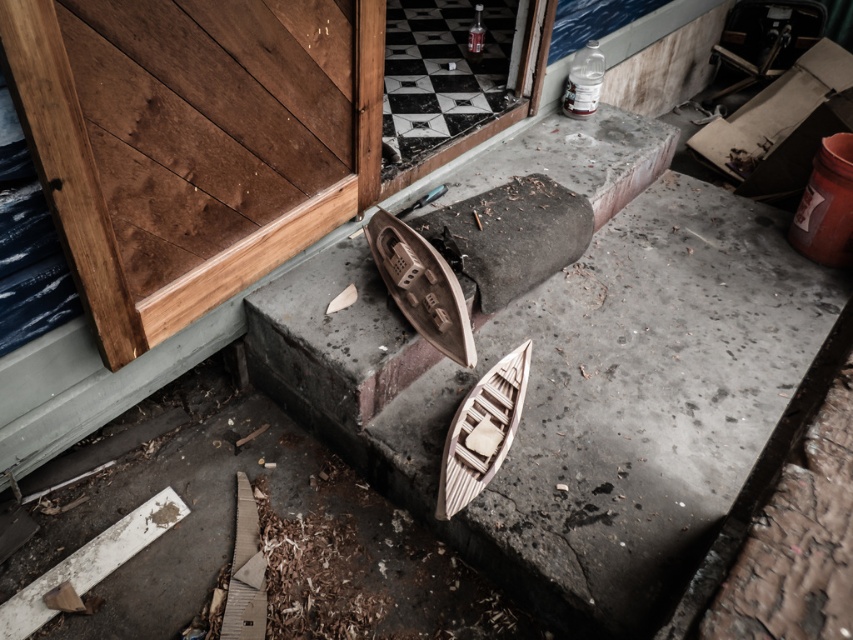
Who is positioned more to the right, smooth concrete boat at center or black glass screen door at upper center?

From the viewer's perspective, smooth concrete boat at center appears more on the right side.

Is smooth concrete boat at center smaller than black glass screen door at upper center?

No.

The width and height of the screenshot is (853, 640). I want to click on smooth concrete boat at center, so click(575, 396).

Between wooden door at left and wooden boat at center, which one has more height?

With more height is wooden door at left.

At what (x,y) coordinates should I click in order to perform the action: click on wooden door at left. Please return your answer as a coordinate pair (x, y). Looking at the image, I should click on (192, 141).

Identify the location of wooden door at left. (192, 141).

The image size is (853, 640). I want to click on wooden door at left, so click(x=192, y=141).

Which of these two, wooden door at left or black glass screen door at upper center, stands taller?

With more height is black glass screen door at upper center.

Is point (80, 180) positioned after point (479, 83)?

No, (80, 180) is in front of (479, 83).

Who is more forward, [245,164] or [489,40]?

Point [245,164] is more forward.

Where is `wooden door at left`? wooden door at left is located at coordinates (192, 141).